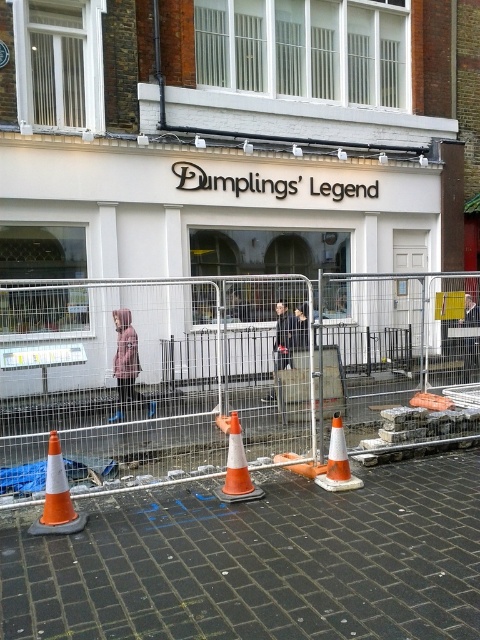
A construction worker needs to place a new traffic cone exactly at the center of the metal fence at center. Given that the coordinate system starts at the bottom left corner of the image, with x increasing to the right and y increasing upwards, what are the coordinates where the worker should place the cone?

The metal fence at center is located at point coordinates of (232, 376). Therefore, the worker should place the new traffic cone at the same coordinates, which is at the center point of the metal fence at center.

You are standing at the entrance of the building and want to locate the white matte sign at center. Based on the coordinates provided, in which direction should you look relative to your position?

The white matte sign at center is located at coordinates point (218,209), which would be directly in front of you at the center position.